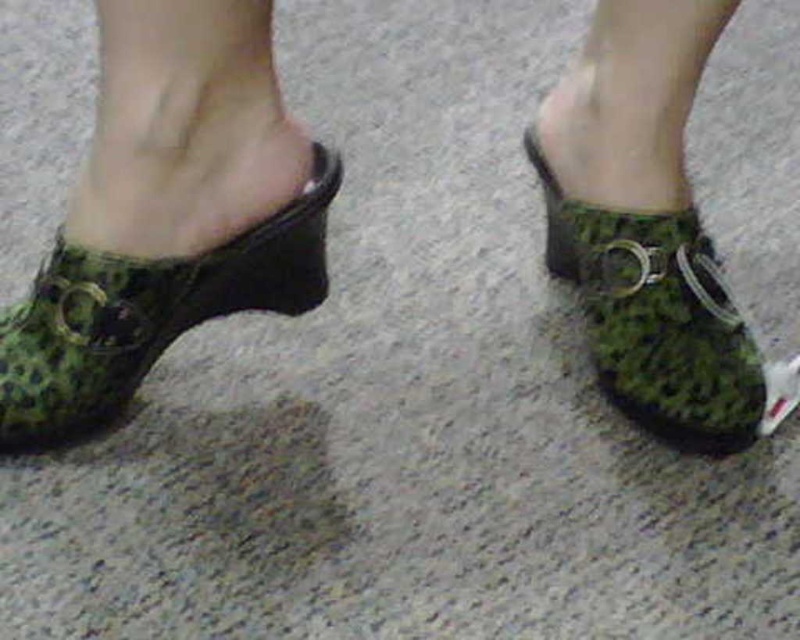
You are standing in a room and see two green clogs on the floor. You need to pick up the one that is on the left side. Which one should you choose between the green leopard print clog at left and the green textured clog at center?

The green leopard print clog at left is to the left of the green textured clog at center, so you should choose the green leopard print clog at left.

You are standing in a room with a textured floor. You see a point at coordinates [145,314]. What object is located at that point?

The green leopard print clog at left is located at point [145,314].

You are trying to decide which pair of shoes to wear today. You have the green leopard print clogs at center and the green leopard print clog at left. Which one is narrower?

The green leopard print clogs at center is narrower than the green leopard print clog at left.